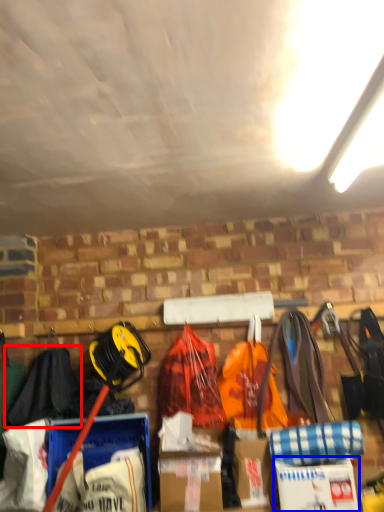
Question: Which of the following is the farthest to the observer, clothing (highlighted by a red box) or cardboard box (highlighted by a blue box)?

Choices:
 (A) clothing
 (B) cardboard box

Answer: (A)